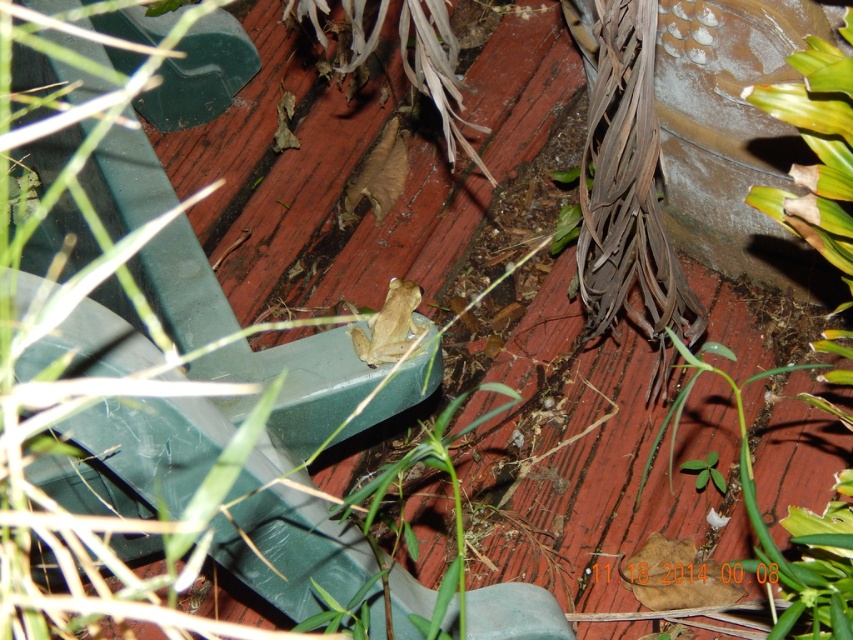
You are a gardener trying to reach the green leafy plant at lower right to prune it. The smooth beige frog at center is in your way. Can you move the frog aside without stepping on it?

The green leafy plant at lower right is taller than the smooth beige frog at center, so you can carefully move the frog aside by lifting it from above since it is shorter than the plant.

You are standing in a garden and see a frog on a green plastic object. There is a point marked at coordinates (790, 531). What object is located at that point?

The point at coordinates (790, 531) corresponds to the green leafy plant at lower right.

You are a gardener trying to water the green leafy plant at lower right and the smooth beige frog at center. Which one should you water first if you want to avoid getting the frog wet?

You should water the green leafy plant at lower right first because it is positioned on the right side of the smooth beige frog at center, so watering the plant first would avoid spraying water towards the frog.